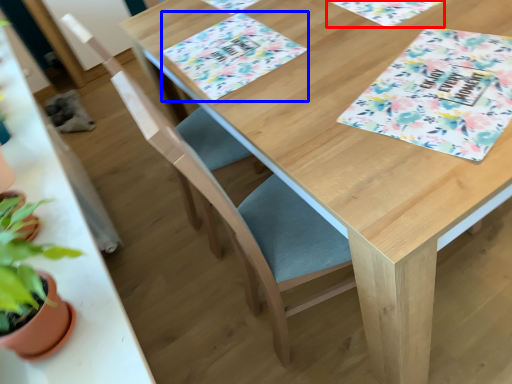
Question: Which object appears farthest to the camera in this image, place mat (highlighted by a red box) or place mat (highlighted by a blue box)?

Choices:
 (A) place mat
 (B) place mat

Answer: (A)